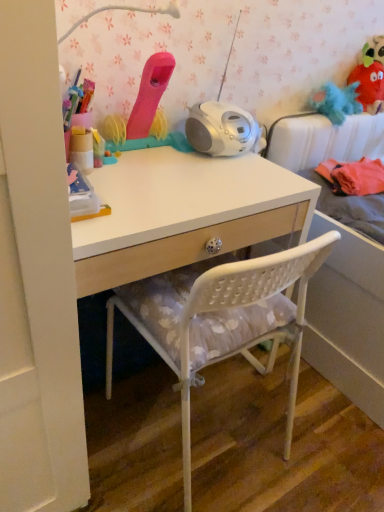
Question: From a real-world perspective, is white plastic chair at center physically above fuzzy fabric plush at upper right, which ranks as the third toy in left-to-right order?

Choices:
 (A) yes
 (B) no

Answer: (B)

Question: Considering the relative sizes of white plastic chair at center and fuzzy fabric plush at upper right, acting as the first toy starting from the right, in the image provided, is white plastic chair at center wider than fuzzy fabric plush at upper right, acting as the first toy starting from the right,?

Choices:
 (A) yes
 (B) no

Answer: (A)

Question: From the image's perspective, is white plastic chair at center above fuzzy fabric plush at upper right, arranged as the 1th toy when viewed from the back?

Choices:
 (A) yes
 (B) no

Answer: (B)

Question: Is white plastic chair at center taller than fuzzy fabric plush at upper right, acting as the first toy starting from the right?

Choices:
 (A) no
 (B) yes

Answer: (B)

Question: Does white plastic chair at center touch fuzzy fabric plush at upper right, arranged as the 1th toy when viewed from the back?

Choices:
 (A) no
 (B) yes

Answer: (A)

Question: Is matte pink toy at upper center, the 1th toy when ordered from left to right, wider or thinner than blue fluffy toy at upper right, which is the 2th toy in left-to-right order?

Choices:
 (A) wide
 (B) thin

Answer: (B)

Question: From their relative heights in the image, would you say matte pink toy at upper center, the 1th toy when ordered from left to right, is taller or shorter than blue fluffy toy at upper right, positioned as the 2th toy in right-to-left order?

Choices:
 (A) short
 (B) tall

Answer: (B)

Question: From the image's perspective, relative to blue fluffy toy at upper right, the 2th toy in the back-to-front sequence, is matte pink toy at upper center, arranged as the first toy when viewed from the front, above or below?

Choices:
 (A) above
 (B) below

Answer: (B)

Question: From a real-world perspective, is matte pink toy at upper center, placed as the third toy when sorted from right to left, physically located above or below blue fluffy toy at upper right, positioned as the 2th toy in right-to-left order?

Choices:
 (A) below
 (B) above

Answer: (B)

Question: From the image's perspective, is blue fluffy toy at upper right, the 2th toy in the back-to-front sequence, positioned above or below matte pink toy at upper center, placed as the third toy when sorted from right to left?

Choices:
 (A) above
 (B) below

Answer: (A)

Question: Considering the positions of blue fluffy toy at upper right, positioned as the 2th toy in right-to-left order, and matte pink toy at upper center, arranged as the first toy when viewed from the front, in the image, is blue fluffy toy at upper right, positioned as the 2th toy in right-to-left order, wider or thinner than matte pink toy at upper center, arranged as the first toy when viewed from the front,?

Choices:
 (A) thin
 (B) wide

Answer: (B)

Question: Do you think blue fluffy toy at upper right, positioned as the 2th toy in right-to-left order, is within matte pink toy at upper center, which is counted as the 3th toy, starting from the back, or outside of it?

Choices:
 (A) inside
 (B) outside

Answer: (B)

Question: Considering the positions of blue fluffy toy at upper right, the 2th toy in the back-to-front sequence, and matte pink toy at upper center, placed as the third toy when sorted from right to left, in the image, is blue fluffy toy at upper right, the 2th toy in the back-to-front sequence, bigger or smaller than matte pink toy at upper center, placed as the third toy when sorted from right to left,?

Choices:
 (A) small
 (B) big

Answer: (A)

Question: Is point (160, 283) closer or farther from the camera than point (352, 78)?

Choices:
 (A) farther
 (B) closer

Answer: (B)

Question: Considering their positions, is white plastic chair at center located in front of or behind fuzzy fabric plush at upper right, acting as the first toy starting from the right?

Choices:
 (A) front
 (B) behind

Answer: (A)